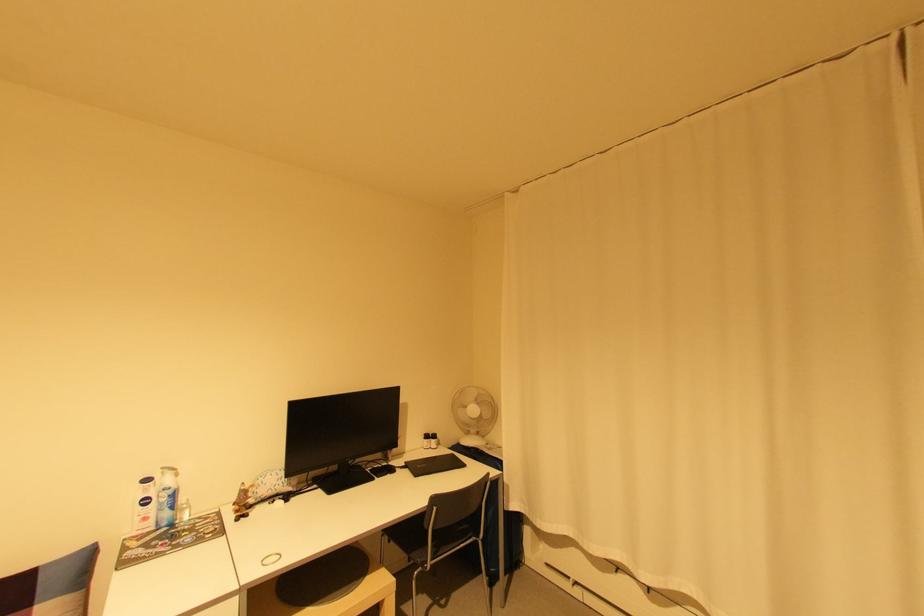
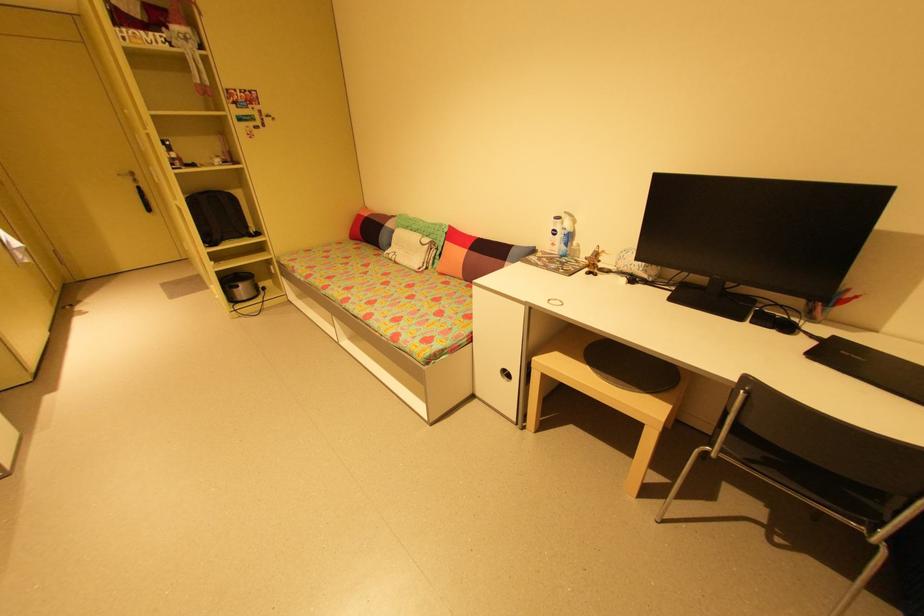
Find the pixel in the second image that matches (x=247, y=504) in the first image.

(597, 262)